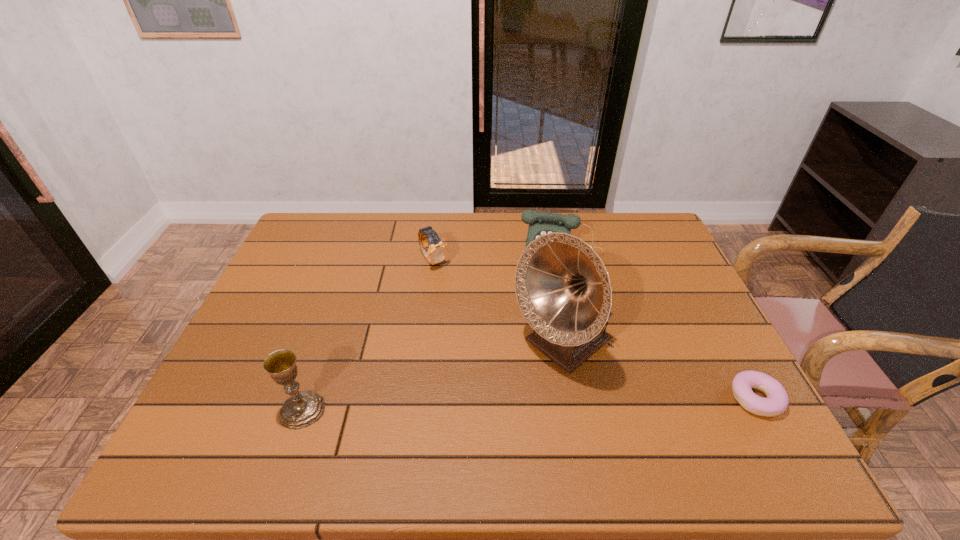
Find the location of a particular element. This screenshot has height=540, width=960. vacant space on the desktop that is between the chalice and the doughnut and is positioned on the face of the fourth object from right to left is located at coordinates (564, 403).

In order to click on vacant space on the desktop that is between the chalice and the rightmost object and is positioned on the horn of the tallest object in this screenshot , I will do point(489,405).

At what (x,y) coordinates should I click in order to perform the action: click on free spot on the desktop that is between the leftmost object and the shortest object and is positioned on the dial of the third shortest object. Please return your answer as a coordinate pair (x, y). Looking at the image, I should click on (547, 403).